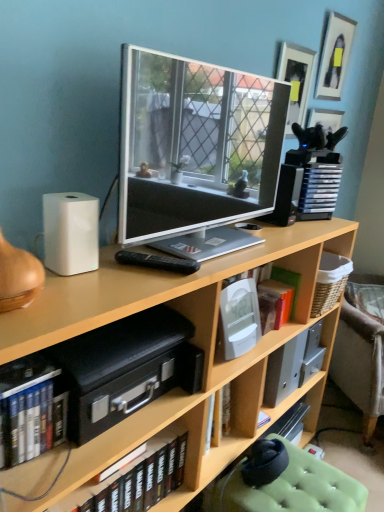
The image size is (384, 512). What are the coordinates of `free spot above green fabric swivel chair at lower right (from a real-world perspective)` in the screenshot? It's located at (304, 485).